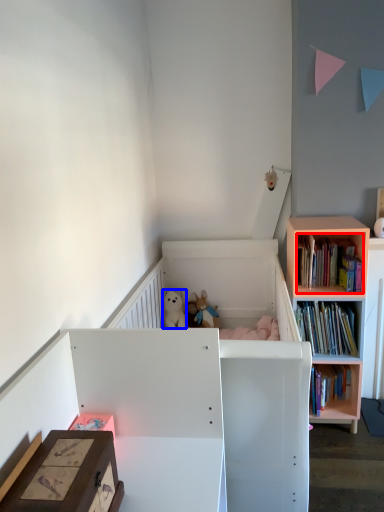
Question: Which object is closer to the camera taking this photo, book (highlighted by a red box) or animal (highlighted by a blue box)?

Choices:
 (A) book
 (B) animal

Answer: (A)